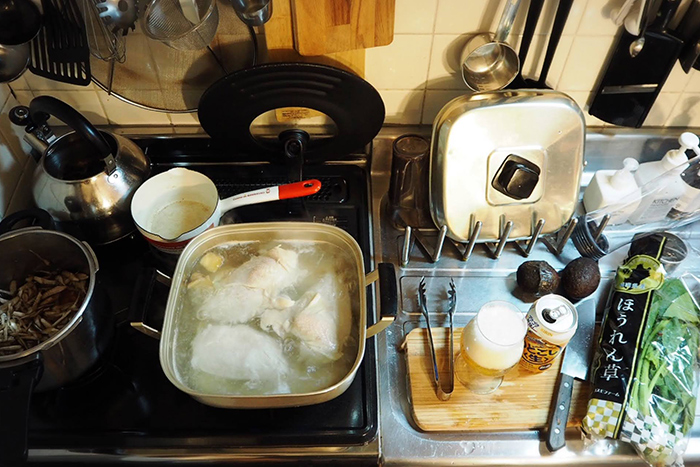
Where is `pots`? This screenshot has width=700, height=467. pots is located at coordinates (192, 198), (57, 255), (309, 395).